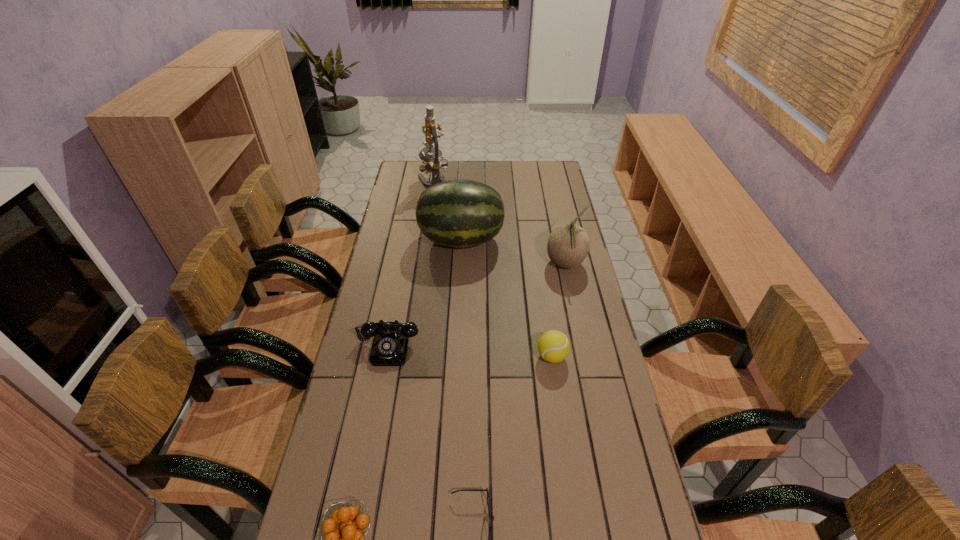
Image resolution: width=960 pixels, height=540 pixels. I want to click on microscope, so click(x=432, y=163).

Identify the location of the tallest object. (432, 163).

In order to click on watermelon in this screenshot , I will do `click(459, 213)`.

Where is `the third tallest object`? Image resolution: width=960 pixels, height=540 pixels. the third tallest object is located at coordinates click(568, 244).

Find the location of a particular element. tennis ball is located at coordinates (553, 346).

Locate an element on the screen. telephone is located at coordinates (390, 344).

The image size is (960, 540). I want to click on free point located 0.170m on the right of the microscope, so click(485, 181).

You are a GUI agent. You are given a task and a screenshot of the screen. Output one action in this format:
    pyautogui.click(x=<x>, y=<y>)
    Task: Click on the free space located 0.160m on the front of the watermelon
    
    Given the screenshot: What is the action you would take?
    pyautogui.click(x=459, y=291)

What are the coordinates of `vacant space located 0.220m on the back of the fifth shortest object` in the screenshot? It's located at (556, 217).

At what (x,y) coordinates should I click in order to perform the action: click on vacant area situated on the left of the tennis ball. Please return your answer as a coordinate pair (x, y). This screenshot has width=960, height=540. Looking at the image, I should click on (514, 356).